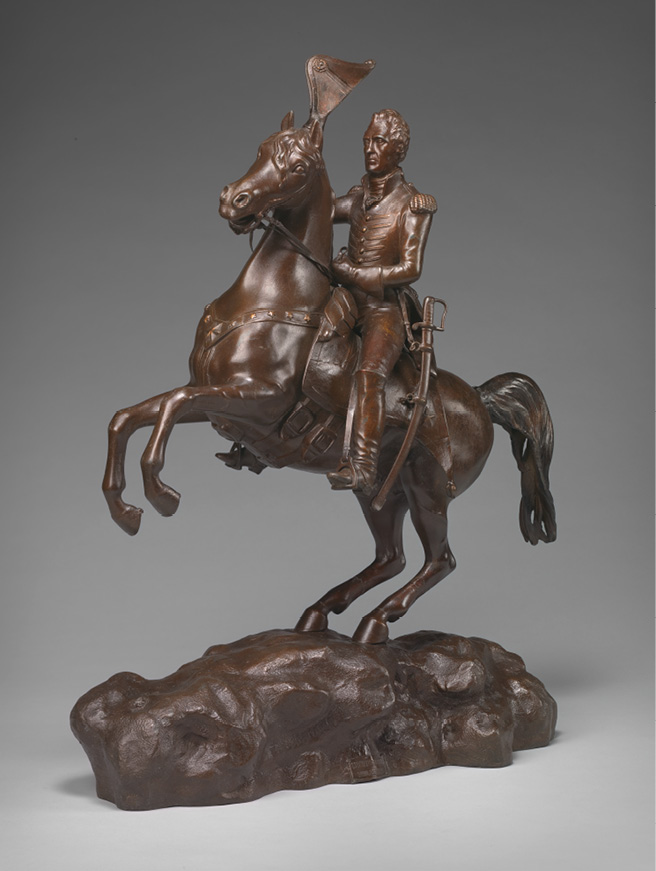
The height and width of the screenshot is (871, 656). What are the coordinates of `backdrop` in the screenshot? It's located at (369, 828), (126, 591), (552, 578), (518, 186), (152, 91).